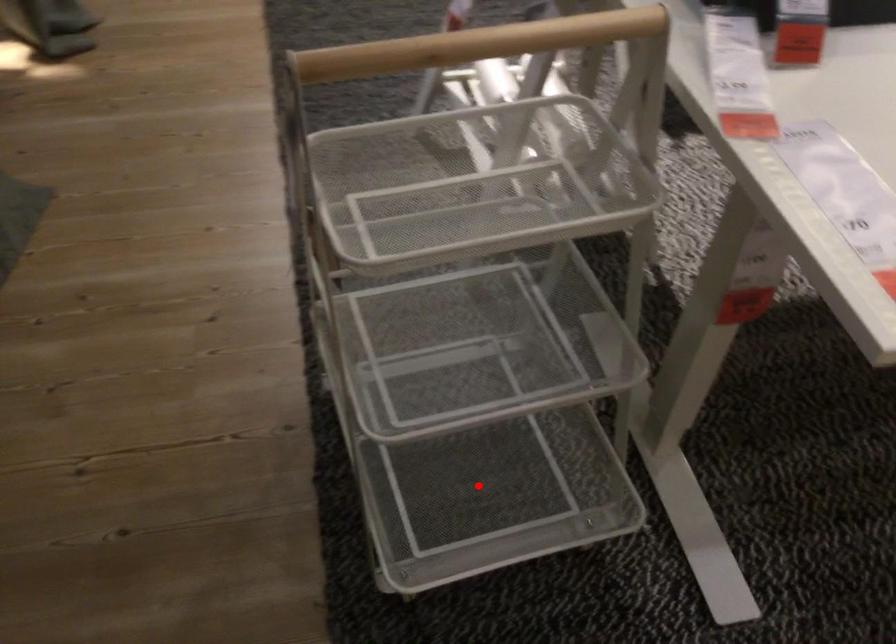
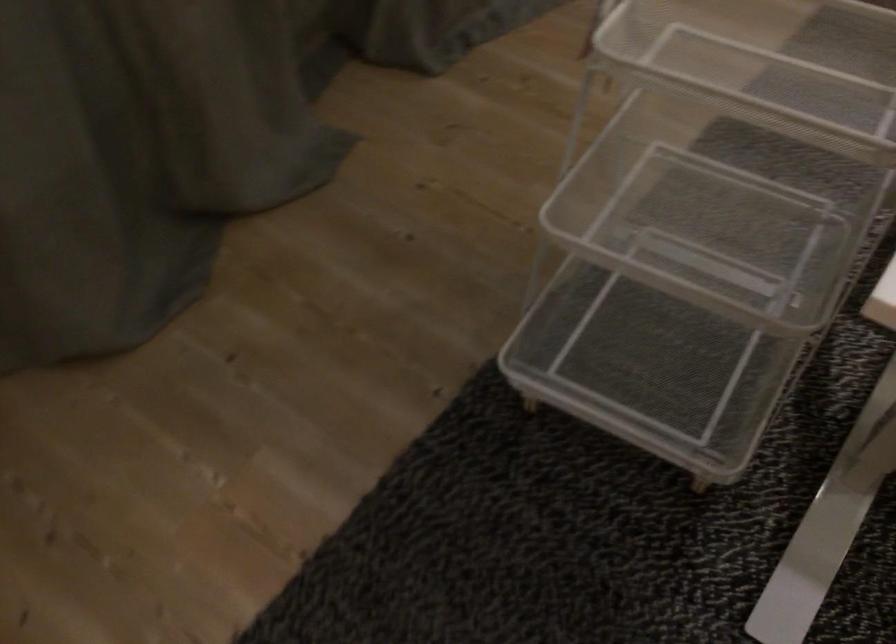
In the second image, find the point that corresponds to the highlighted location in the first image.

(651, 361)